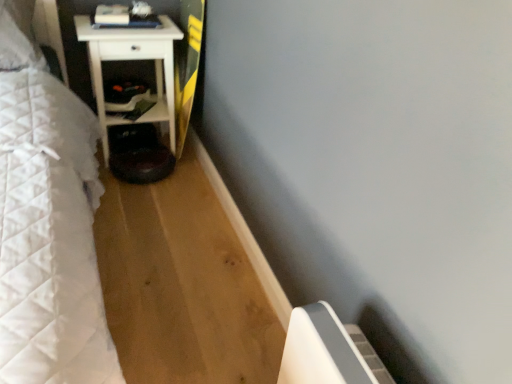
At what (x,y) coordinates should I click in order to perform the action: click on free space in front of yellow-green wood longboard at center. Please return your answer as a coordinate pair (x, y). Image resolution: width=512 pixels, height=384 pixels. Looking at the image, I should click on (176, 188).